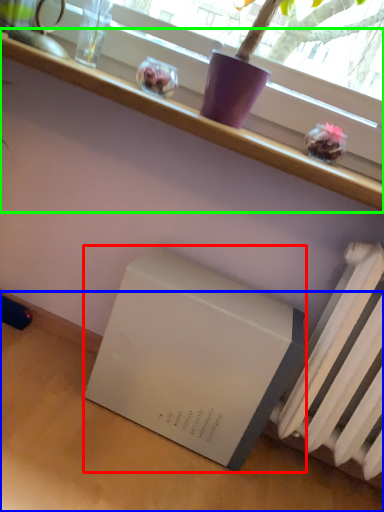
Question: Which object is the farthest from appliance (highlighted by a red box)? Choose among these: table (highlighted by a blue box) or furniture (highlighted by a green box).

Choices:
 (A) table
 (B) furniture

Answer: (B)